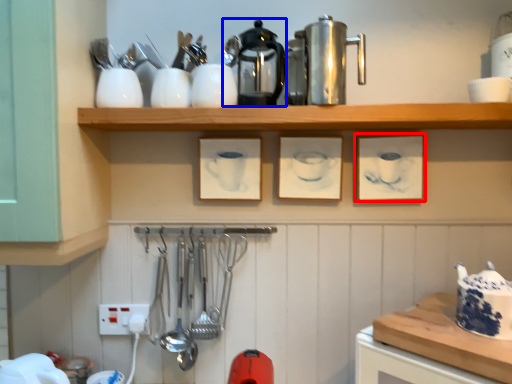
Question: Among these objects, which one is farthest to the camera, picture frame (highlighted by a red box) or coffeepot (highlighted by a blue box)?

Choices:
 (A) picture frame
 (B) coffeepot

Answer: (A)